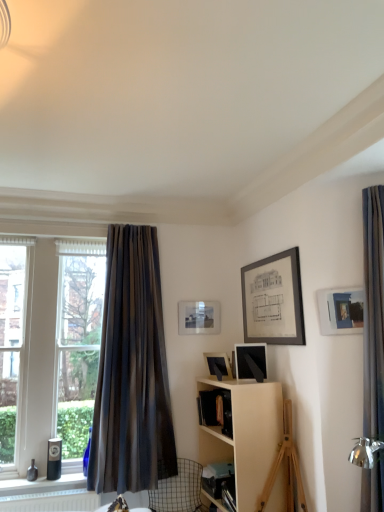
Question: Is point (251, 376) positioned closer to the camera than point (178, 492)?

Choices:
 (A) closer
 (B) farther

Answer: (A)

Question: From the image's perspective, is matte black picture frame at upper right, the 3th picture frame in the left-to-right sequence, above or below metallic wire swivel chair at lower left?

Choices:
 (A) above
 (B) below

Answer: (A)

Question: Which of these objects is positioned closest to the matte white picture frame at upper right, which appears as the fourth picture frame when viewed from the back?

Choices:
 (A) matte silver picture frame at upper center, the first picture frame positioned from the back
 (B) matte black picture frame at center, the 2th picture frame in the back-to-front sequence
 (C) clear glass window at left
 (D) metallic wire swivel chair at lower left
 (E) dark gray textured curtain at left

Answer: (B)

Question: Which of these objects is positioned closest to the dark gray textured curtain at left?

Choices:
 (A) clear glass window at left
 (B) matte silver picture frame at upper center, the first picture frame positioned from the back
 (C) matte white picture frame at upper right, which is the fourth picture frame from left to right
 (D) metallic wire swivel chair at lower left
 (E) matte black picture frame at upper right, the 2th picture frame viewed from the front

Answer: (A)